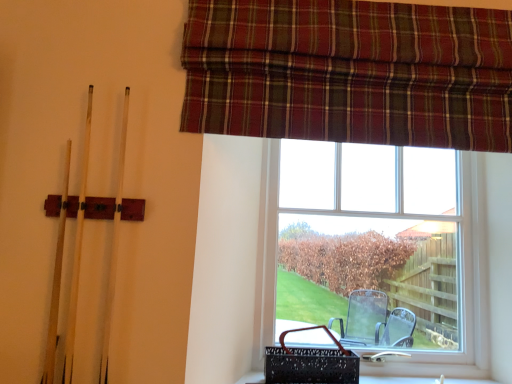
Locate an element on the screen. This screenshot has height=384, width=512. clear glass window at center is located at coordinates (375, 248).

Based on the photo, measure the distance between clear glass window at center and camera.

The distance of clear glass window at center from camera is 5.07 feet.

This screenshot has width=512, height=384. What do you see at coordinates (375, 248) in the screenshot?
I see `clear glass window at center` at bounding box center [375, 248].

This screenshot has width=512, height=384. I want to click on plaid fabric curtain at upper right, so click(349, 72).

This screenshot has width=512, height=384. What do you see at coordinates (349, 72) in the screenshot?
I see `plaid fabric curtain at upper right` at bounding box center [349, 72].

Measure the distance between plaid fabric curtain at upper right and camera.

plaid fabric curtain at upper right and camera are 1.11 meters apart from each other.

Where is `clear glass window at center`? Image resolution: width=512 pixels, height=384 pixels. clear glass window at center is located at coordinates (375, 248).

Considering the relative positions of clear glass window at center and plaid fabric curtain at upper right in the image provided, is clear glass window at center to the left of plaid fabric curtain at upper right from the viewer's perspective?

Incorrect, clear glass window at center is not on the left side of plaid fabric curtain at upper right.

Looking at this image, is clear glass window at center closer to the viewer compared to plaid fabric curtain at upper right?

No, clear glass window at center is behind plaid fabric curtain at upper right.

Which is closer, (444, 162) or (398, 41)?

The point (398, 41) is in front.

In the scene shown: From the image's perspective, is clear glass window at center on plaid fabric curtain at upper right?

Incorrect, from the image's perspective, clear glass window at center is lower than plaid fabric curtain at upper right.

From a real-world perspective, is clear glass window at center physically below plaid fabric curtain at upper right?

Correct, in the physical world, clear glass window at center is lower than plaid fabric curtain at upper right.

Does clear glass window at center have a greater width compared to plaid fabric curtain at upper right?

Yes.

Considering the sizes of objects clear glass window at center and plaid fabric curtain at upper right in the image provided, who is taller, clear glass window at center or plaid fabric curtain at upper right?

clear glass window at center.

Does clear glass window at center have a smaller size compared to plaid fabric curtain at upper right?

Incorrect, clear glass window at center is not smaller in size than plaid fabric curtain at upper right.

Is clear glass window at center not within plaid fabric curtain at upper right?

Absolutely, clear glass window at center is external to plaid fabric curtain at upper right.

Is the surface of clear glass window at center in direct contact with plaid fabric curtain at upper right?

clear glass window at center and plaid fabric curtain at upper right are clearly separated.

Is clear glass window at center looking in the opposite direction of plaid fabric curtain at upper right?

No, clear glass window at center's orientation is not away from plaid fabric curtain at upper right.

How many degrees apart are the facing directions of clear glass window at center and plaid fabric curtain at upper right?

The facing directions of clear glass window at center and plaid fabric curtain at upper right are 0.708 degrees apart.

Identify the location of window below the plaid fabric curtain at upper right (from the image's perspective). click(x=375, y=248).

Considering the positions of objects plaid fabric curtain at upper right and clear glass window at center in the image provided, who is more to the right, plaid fabric curtain at upper right or clear glass window at center?

Positioned to the right is clear glass window at center.

Which object is further away from the camera taking this photo, plaid fabric curtain at upper right or clear glass window at center?

clear glass window at center.

Considering the points (276, 91) and (286, 268), which point is in front, point (276, 91) or point (286, 268)?

The point (276, 91) is closer to the camera.

Based on the photo, from the image's perspective, is plaid fabric curtain at upper right beneath clear glass window at center?

Actually, plaid fabric curtain at upper right appears above clear glass window at center in the image.

From a real-world perspective, who is located lower, plaid fabric curtain at upper right or clear glass window at center?

In real-world perspective, clear glass window at center is lower.

Considering the sizes of objects plaid fabric curtain at upper right and clear glass window at center in the image provided, who is thinner, plaid fabric curtain at upper right or clear glass window at center?

plaid fabric curtain at upper right is thinner.

In terms of height, does plaid fabric curtain at upper right look taller or shorter compared to clear glass window at center?

plaid fabric curtain at upper right is shorter than clear glass window at center.

Who is bigger, plaid fabric curtain at upper right or clear glass window at center?

With larger size is clear glass window at center.

Is plaid fabric curtain at upper right outside of clear glass window at center?

That's correct, plaid fabric curtain at upper right is outside of clear glass window at center.

Consider the image. Does plaid fabric curtain at upper right touch clear glass window at center?

plaid fabric curtain at upper right and clear glass window at center are not in contact.

Is plaid fabric curtain at upper right turned away from clear glass window at center?

No.

What are the coordinates of `curtain located above the clear glass window at center (from a real-world perspective)` in the screenshot? It's located at tap(349, 72).

Identify the location of window behind the plaid fabric curtain at upper right. The height and width of the screenshot is (384, 512). (375, 248).

Where is `curtain above the clear glass window at center (from a real-world perspective)`? The width and height of the screenshot is (512, 384). curtain above the clear glass window at center (from a real-world perspective) is located at coordinates (349, 72).